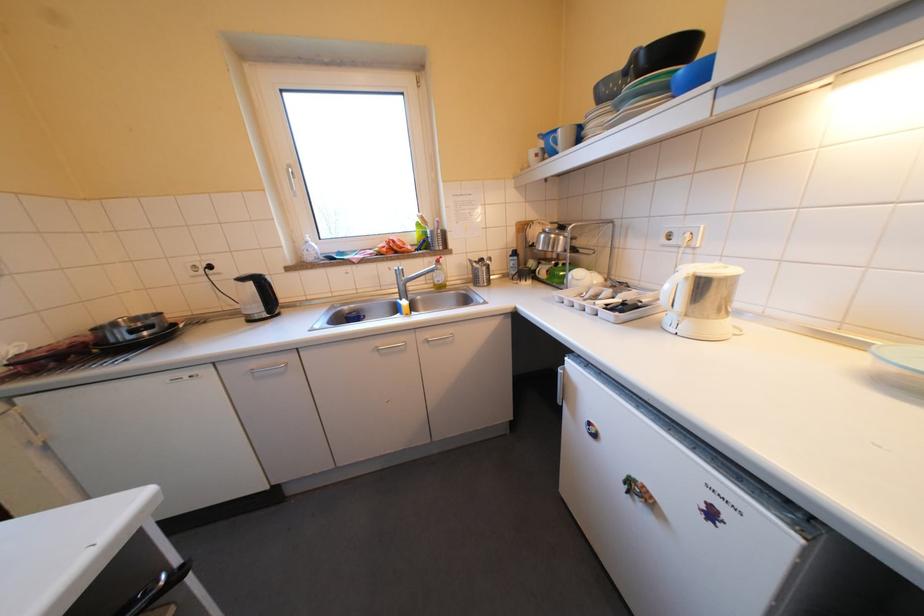
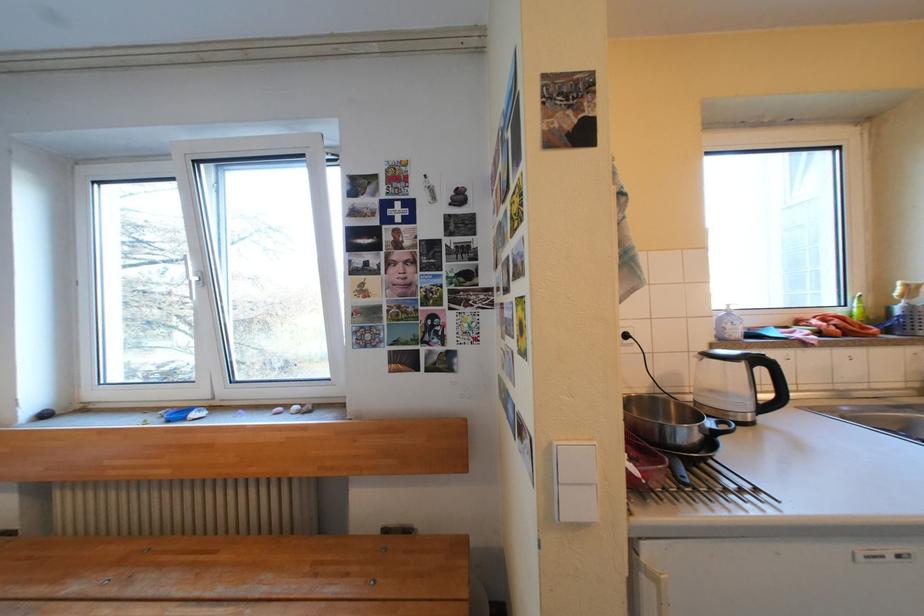
Question: In a continuous first-person perspective shot, in which direction is the camera moving?

Choices:
 (A) Left
 (B) Right
 (C) Forward
 (D) Backward

Answer: (A)